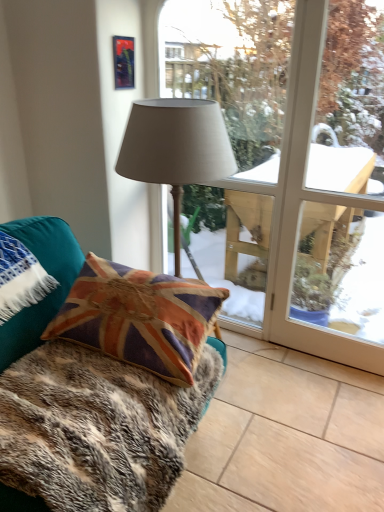
Describe the element at coordinates (176, 148) in the screenshot. This screenshot has height=512, width=384. I see `matte gray fabric lamp at center` at that location.

Identify the location of velvet union jack pillow at lower left. (47, 272).

This screenshot has width=384, height=512. Describe the element at coordinates (291, 167) in the screenshot. I see `matte gray lampshade at center` at that location.

Locate an element on the screen. This screenshot has width=384, height=512. velvet union jack pillow at left is located at coordinates (49, 273).

Considering the relative sizes of fur-like fabric at lower left and metallic reflective picture frame at upper center in the image provided, is fur-like fabric at lower left smaller than metallic reflective picture frame at upper center?

Incorrect, fur-like fabric at lower left is not smaller in size than metallic reflective picture frame at upper center.

Can you confirm if fur-like fabric at lower left is taller than metallic reflective picture frame at upper center?

No, fur-like fabric at lower left is not taller than metallic reflective picture frame at upper center.

In order to click on picture frame that is on the left side of fur-like fabric at lower left in this screenshot , I will do `click(123, 62)`.

Is fur-like fabric at lower left facing towards metallic reflective picture frame at upper center?

No, fur-like fabric at lower left is not facing towards metallic reflective picture frame at upper center.

From a real-world perspective, which is physically above, matte gray lampshade at center or metallic reflective picture frame at upper center?

metallic reflective picture frame at upper center.

Does matte gray lampshade at center appear on the right side of metallic reflective picture frame at upper center?

Yes, matte gray lampshade at center is to the right of metallic reflective picture frame at upper center.

From the image's perspective, is matte gray lampshade at center over metallic reflective picture frame at upper center?

No, from the image's perspective, matte gray lampshade at center is not over metallic reflective picture frame at upper center.

Does point (216, 28) lie behind point (127, 86)?

That is True.

Is metallic reflective picture frame at upper center thinner than velvet union jack pillow at lower left?

Correct, the width of metallic reflective picture frame at upper center is less than that of velvet union jack pillow at lower left.

Which is correct: metallic reflective picture frame at upper center is inside velvet union jack pillow at lower left, or outside of it?

metallic reflective picture frame at upper center lies outside velvet union jack pillow at lower left.

Is metallic reflective picture frame at upper center far away from velvet union jack pillow at lower left?

No, metallic reflective picture frame at upper center is in close proximity to velvet union jack pillow at lower left.

Considering the relative positions of metallic reflective picture frame at upper center and velvet union jack pillow at lower left in the image provided, is metallic reflective picture frame at upper center to the left or to the right of velvet union jack pillow at lower left?

From the image, it's evident that metallic reflective picture frame at upper center is to the left of velvet union jack pillow at lower left.

From a real-world perspective, is velvet union jack pillow at left above or below metallic reflective picture frame at upper center?

velvet union jack pillow at left is situated lower than metallic reflective picture frame at upper center in the real world.

Who is smaller, velvet union jack pillow at left or metallic reflective picture frame at upper center?

metallic reflective picture frame at upper center is smaller.

Is velvet union jack pillow at left not close to metallic reflective picture frame at upper center?

No, there isn't a large distance between velvet union jack pillow at left and metallic reflective picture frame at upper center.

From the picture: Is matte gray fabric lamp at center closer to the viewer compared to matte gray lampshade at center?

Yes, matte gray fabric lamp at center is closer to the camera.

Is matte gray fabric lamp at center at the left side of matte gray lampshade at center?

Yes, matte gray fabric lamp at center is to the left of matte gray lampshade at center.

From the picture: How different are the orientations of matte gray fabric lamp at center and matte gray lampshade at center in degrees?

The angular difference between matte gray fabric lamp at center and matte gray lampshade at center is 1.86 degrees.

Is matte gray lampshade at center at the back of matte gray fabric lamp at center?

Yes.

Can you tell me how much velvet union jack pillow at left and fur-like fabric at lower left differ in facing direction?

velvet union jack pillow at left and fur-like fabric at lower left are facing 88.5 degrees away from each other.

Image resolution: width=384 pixels, height=512 pixels. Find the location of `pillow that appears behind the fur-like fabric at lower left`. pillow that appears behind the fur-like fabric at lower left is located at coordinates (49, 273).

Considering the relative positions of velvet union jack pillow at left and fur-like fabric at lower left in the image provided, is velvet union jack pillow at left to the left or to the right of fur-like fabric at lower left?

From the image, it's evident that velvet union jack pillow at left is to the left of fur-like fabric at lower left.

Looking at this image, from a real-world perspective, who is located higher, matte gray fabric lamp at center or fur-like fabric at lower left?

matte gray fabric lamp at center, from a real-world perspective.

Does matte gray fabric lamp at center have a lesser width compared to fur-like fabric at lower left?

Yes, matte gray fabric lamp at center is thinner than fur-like fabric at lower left.

Is matte gray fabric lamp at center positioned beyond the bounds of fur-like fabric at lower left?

Yes, matte gray fabric lamp at center is not within fur-like fabric at lower left.

The image size is (384, 512). What are the coordinates of `picture frame lying behind the fur-like fabric at lower left` in the screenshot? It's located at (123, 62).

At what (x,y) coordinates should I click in order to perform the action: click on bay window in front of the metallic reflective picture frame at upper center. Please return your answer as a coordinate pair (x, y). This screenshot has width=384, height=512. Looking at the image, I should click on pos(291,167).

From the image, which object appears to be farther from fur-like fabric at lower left, metallic reflective picture frame at upper center or matte gray fabric lamp at center?

metallic reflective picture frame at upper center lies further to fur-like fabric at lower left than the other object.

Based on their spatial positions, is velvet union jack pillow at lower left or velvet union jack pillow at left closer to matte gray fabric lamp at center?

The object closer to matte gray fabric lamp at center is velvet union jack pillow at left.

Based on the photo, estimate the real-world distances between objects in this image. Which object is closer to matte gray lampshade at center, matte gray fabric lamp at center or velvet union jack pillow at left?

matte gray fabric lamp at center.

From the image, which object appears to be farther from velvet union jack pillow at left, matte gray lampshade at center or metallic reflective picture frame at upper center?

matte gray lampshade at center is further to velvet union jack pillow at left.

Based on their spatial positions, is fur-like fabric at lower left or matte gray lampshade at center closer to velvet union jack pillow at lower left?

fur-like fabric at lower left is positioned closer to the anchor velvet union jack pillow at lower left.

Based on their spatial positions, is matte gray fabric lamp at center or velvet union jack pillow at lower left further from velvet union jack pillow at left?

The object further to velvet union jack pillow at left is matte gray fabric lamp at center.

Consider the image. Estimate the real-world distances between objects in this image. Which object is further from velvet union jack pillow at lower left, fur-like fabric at lower left or velvet union jack pillow at left?

Among the two, fur-like fabric at lower left is located further to velvet union jack pillow at lower left.

Considering their positions, is velvet union jack pillow at left positioned closer to matte gray fabric lamp at center than metallic reflective picture frame at upper center?

velvet union jack pillow at left is positioned closer to the anchor matte gray fabric lamp at center.

Identify the location of studio couch between metallic reflective picture frame at upper center and fur-like fabric at lower left vertically. The height and width of the screenshot is (512, 384). (47, 272).

This screenshot has width=384, height=512. What are the coordinates of `studio couch between matte gray lampshade at center and fur-like fabric at lower left from top to bottom` in the screenshot? It's located at (47, 272).

You are a GUI agent. You are given a task and a screenshot of the screen. Output one action in this format:
    pyautogui.click(x=<x>, y=<y>)
    Task: Click on the bay window between metallic reflective picture frame at upper center and velvet union jack pillow at lower left in the up-down direction
    The image size is (384, 512).
    Given the screenshot: What is the action you would take?
    pyautogui.click(x=291, y=167)

What are the coordinates of `lamp between matte gray lampshade at center and fur-like fabric at lower left in the up-down direction` in the screenshot? It's located at (176, 148).